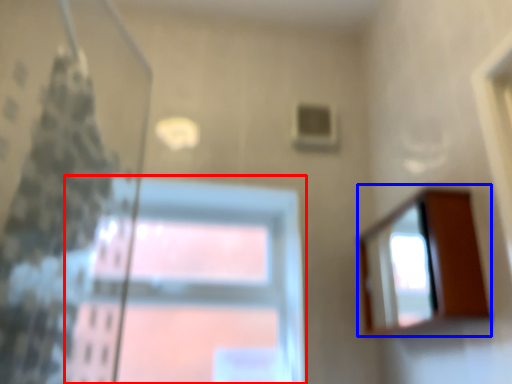
Question: Which object is closer to the camera taking this photo, window (highlighted by a red box) or mirror (highlighted by a blue box)?

Choices:
 (A) window
 (B) mirror

Answer: (B)